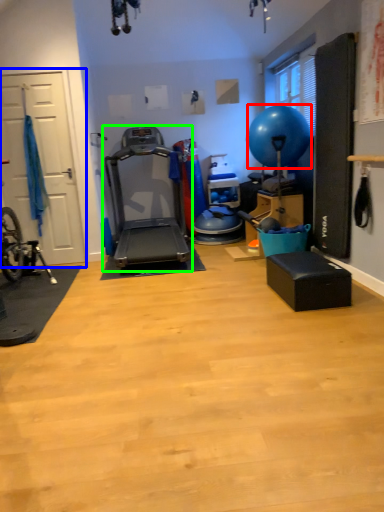
Question: Based on their relative distances, which object is farther from balloon (highlighted by a red box)? Choose from garage door (highlighted by a blue box) and treadmill (highlighted by a green box).

Choices:
 (A) garage door
 (B) treadmill

Answer: (A)